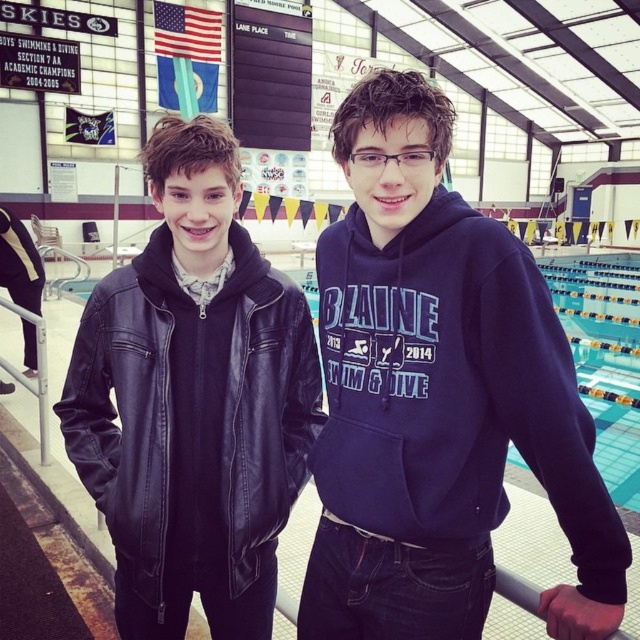
Question: Is leather jacket at left smaller than white metallic rail at left?

Choices:
 (A) no
 (B) yes

Answer: (B)

Question: Is the position of navy blue hoodie at center more distant than that of blue tile swimming pool at center?

Choices:
 (A) yes
 (B) no

Answer: (B)

Question: Estimate the real-world distances between objects in this image. Which object is closer to the white metallic rail at left?

Choices:
 (A) navy blue hoodie at center
 (B) blue tile swimming pool at center
 (C) leather jacket at left

Answer: (C)

Question: Can you confirm if navy blue hoodie at center is positioned to the right of leather jacket at left?

Choices:
 (A) yes
 (B) no

Answer: (A)

Question: Which of the following is the farthest from the observer?

Choices:
 (A) blue tile swimming pool at center
 (B) leather jacket at left
 (C) navy blue hoodie at center

Answer: (A)

Question: Which of the following is the closest to the observer?

Choices:
 (A) (472, 248)
 (B) (141, 420)
 (C) (625, 348)

Answer: (A)